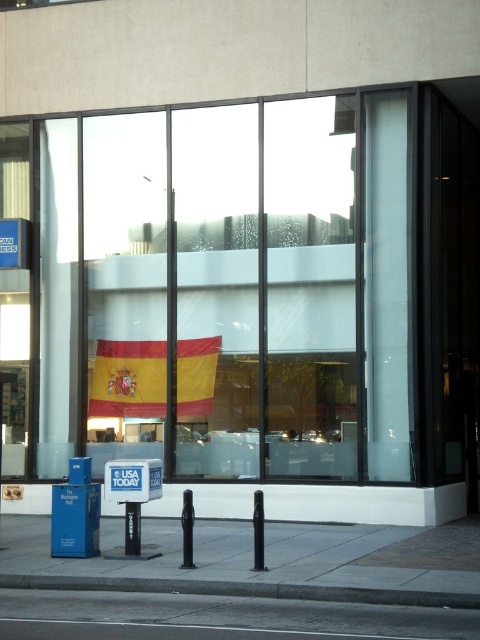
Is yellow fabric flag at center positioned behind red/yellow striped flag at center?

No, yellow fabric flag at center is closer to the viewer.

Is yellow fabric flag at center to the right of red/yellow striped flag at center from the viewer's perspective?

Indeed, yellow fabric flag at center is positioned on the right side of red/yellow striped flag at center.

Does point (46, 195) come farther from viewer compared to point (122, 348)?

Yes.

This screenshot has height=640, width=480. I want to click on yellow fabric flag at center, so click(257, 298).

Is point (289, 128) more distant than point (265, 572)?

Yes, point (289, 128) is farther from viewer.

You are a GUI agent. You are given a task and a screenshot of the screen. Output one action in this format:
    pyautogui.click(x=<x>, y=<y>)
    Task: Click on the yellow fabric flag at center
    
    Given the screenshot: What is the action you would take?
    pyautogui.click(x=257, y=298)

Find the location of a particular element. The image size is (480, 640). gray concrete pavement at lower center is located at coordinates (242, 563).

Is point (168, 552) in front of point (44, 602)?

No, it is not.

You are a GUI agent. You are given a task and a screenshot of the screen. Output one action in this format:
    pyautogui.click(x=<x>, y=<y>)
    Task: Click on the gray concrete pavement at lower center
    
    Given the screenshot: What is the action you would take?
    pyautogui.click(x=242, y=563)